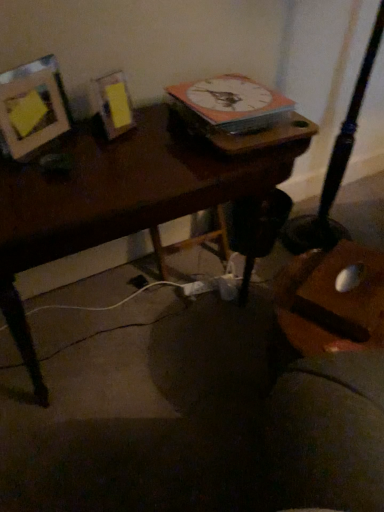
This screenshot has height=512, width=384. Find the location of `free location in front of matte wood picture frame at upper left`. free location in front of matte wood picture frame at upper left is located at coordinates (45, 188).